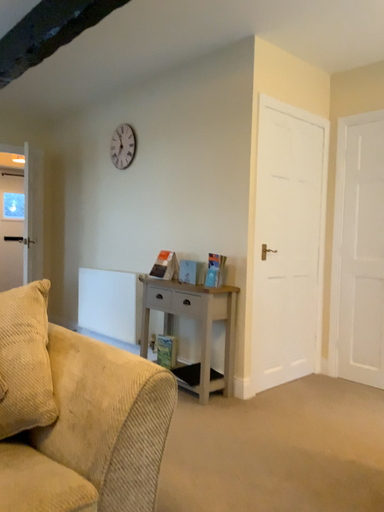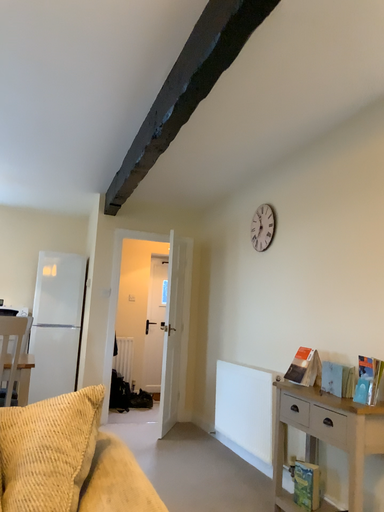
Question: How did the camera likely rotate when shooting the video?

Choices:
 (A) rotated left
 (B) rotated right

Answer: (A)